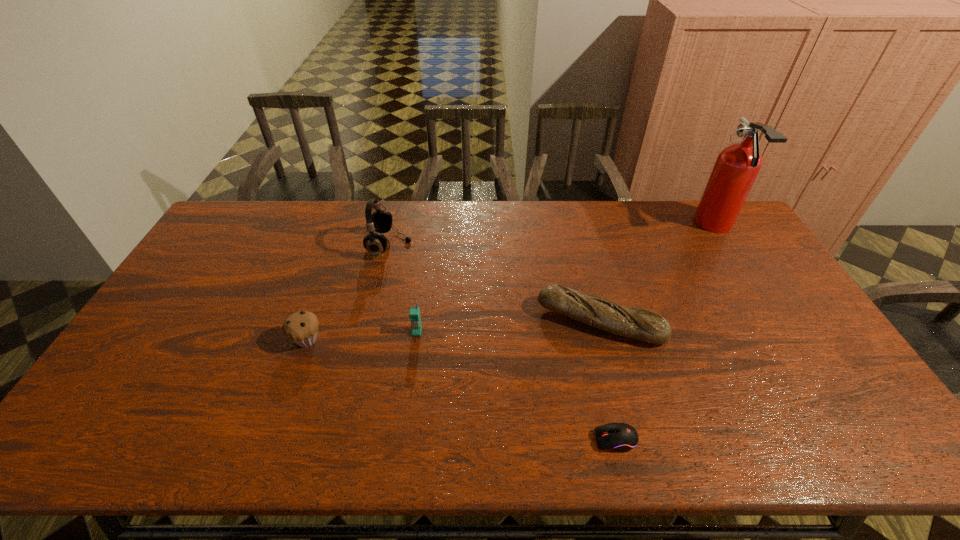
You are a GUI agent. You are given a task and a screenshot of the screen. Output one action in this format:
    pyautogui.click(x=<x>, y=<y>)
    Task: Click on the vacant area that lies between the baguet and the leftmost object
    The width and height of the screenshot is (960, 540).
    Given the screenshot: What is the action you would take?
    (454, 330)

Identify the location of vacant point located between the cellular telephone and the tallest object. The height and width of the screenshot is (540, 960). (565, 279).

The image size is (960, 540). In order to click on empty location between the leftmost object and the fire extinguisher in this screenshot , I will do `click(511, 283)`.

Identify the location of blank region between the leftmost object and the baguet. (454, 330).

What are the coordinates of `empty space between the nearest object and the baguet` in the screenshot? It's located at (608, 380).

This screenshot has width=960, height=540. Find the location of `vacant space in between the fifth shortest object and the rightmost object`. vacant space in between the fifth shortest object and the rightmost object is located at coordinates (552, 235).

This screenshot has height=540, width=960. I want to click on vacant region between the shortest object and the muffin, so click(461, 389).

I want to click on the third closest object to the baguet, so click(x=737, y=166).

Where is `the fifth closest object to the muffin`? This screenshot has width=960, height=540. the fifth closest object to the muffin is located at coordinates (737, 166).

Find the location of a particular element. vacant space that satisfies the following two spatial constraints: 1. on the keypad of the third tallest object; 2. on the right side of the nearest object is located at coordinates (403, 439).